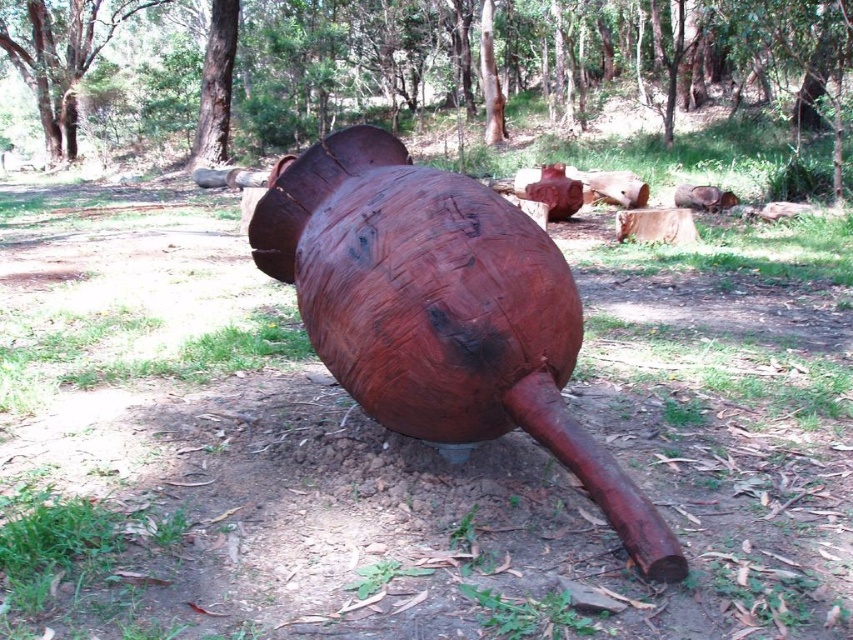
Question: Is smooth brown wooden log at center bigger than smooth brown tree trunk at upper left?

Choices:
 (A) yes
 (B) no

Answer: (A)

Question: Among these points, which one is farthest from the camera?

Choices:
 (A) (599, 44)
 (B) (51, 84)
 (C) (502, 272)

Answer: (A)

Question: Is rustic wood sculpture at center below smooth brown tree trunk at upper left?

Choices:
 (A) yes
 (B) no

Answer: (A)

Question: Which object is farther from the camera taking this photo?

Choices:
 (A) smooth brown tree trunk at upper left
 (B) smooth brown wooden log at center

Answer: (A)

Question: Which point appears closest to the camera in this image?

Choices:
 (A) (10, 10)
 (B) (241, 29)

Answer: (B)

Question: Considering the relative positions of rustic wood sculpture at center and smooth brown tree trunk at upper left in the image provided, where is rustic wood sculpture at center located with respect to smooth brown tree trunk at upper left?

Choices:
 (A) right
 (B) left

Answer: (A)